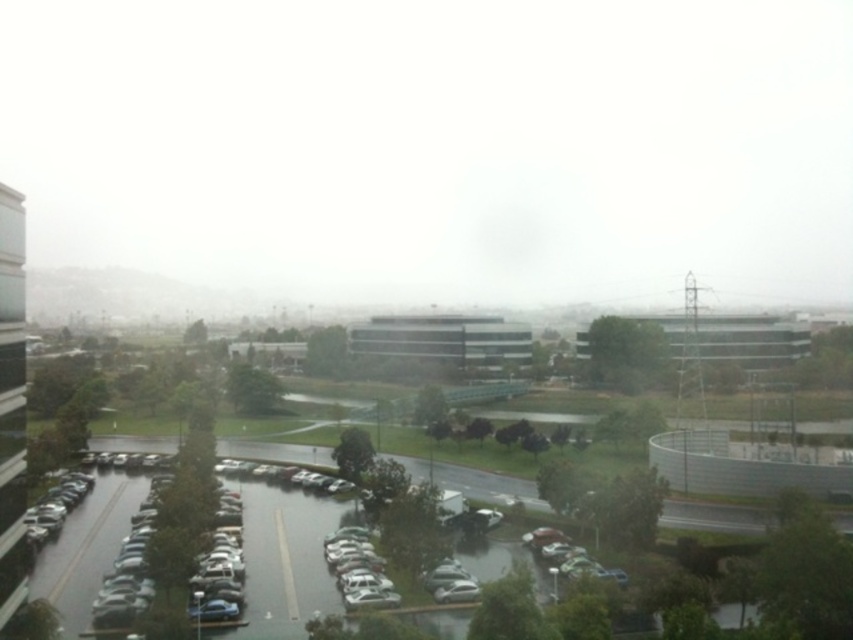
You are driving a car and need to park in the parking lot shown in the image. As you look at the glossy asphalt parking lot at lower left, where is the white foggy sky at upper center located relative to it?

The white foggy sky at upper center is positioned on the right side of the glossy asphalt parking lot at lower left.

You are standing at the edge of the parking lot and want to reach a specific point marked as point (166,161). Given that your walking speed is 1.5 meters per second, how many seconds will it take you to reach that point?

The distance to point (166,161) is 312.52 meters. At a speed of 1.5 meters per second, it will take approximately 208.35 seconds to reach the point.

You are a photographer planning to capture the entire scene of the white foggy sky at upper center and the glossy asphalt parking lot at lower left. Which area should you focus on first if you want to ensure both are fully in frame without moving the camera?

The white foggy sky at upper center has a larger width than the glossy asphalt parking lot at lower left, so you should focus on capturing the white foggy sky at upper center first to ensure it fits entirely within the frame before adjusting for the parking lot.